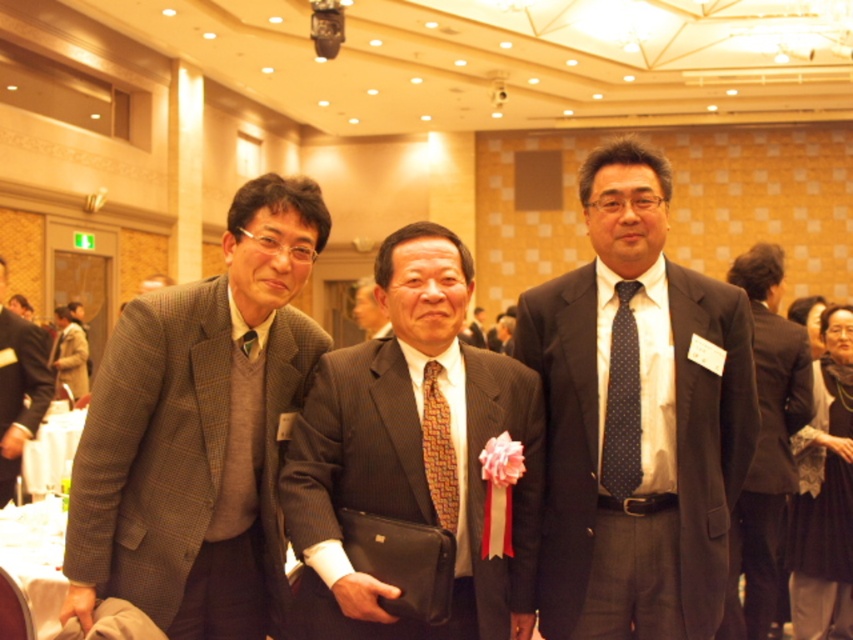
Question: Considering the real-world distances, which object is closest to the brown pinstripe suit at center?

Choices:
 (A) brown wool jacket at left
 (B) brown woven tie at center

Answer: (B)

Question: Is dark gray suit at center wider than brown woven tie at center?

Choices:
 (A) yes
 (B) no

Answer: (A)

Question: Can you confirm if brown pinstripe suit at center is wider than satin black suit at right?

Choices:
 (A) yes
 (B) no

Answer: (B)

Question: Which point is farther to the camera?

Choices:
 (A) [421, 474]
 (B) [662, 582]
 (C) [438, 513]

Answer: (B)

Question: Is satin black suit at right to the left of dark blue dotted tie at center from the viewer's perspective?

Choices:
 (A) yes
 (B) no

Answer: (B)

Question: Which of the following is the closest to the observer?

Choices:
 (A) (605, 481)
 (B) (55, 396)

Answer: (A)